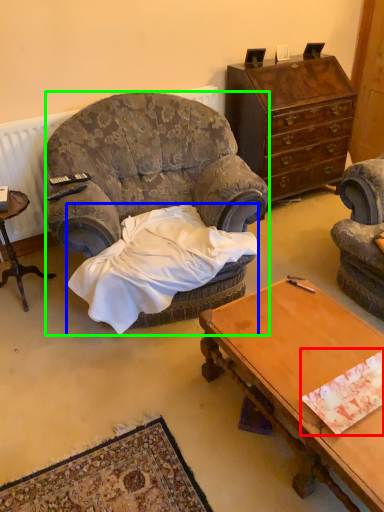
Question: Which object is positioned farthest from sheet (highlighted by a red box)? Select from blanket (highlighted by a blue box) and chair (highlighted by a green box).

Choices:
 (A) blanket
 (B) chair

Answer: (B)